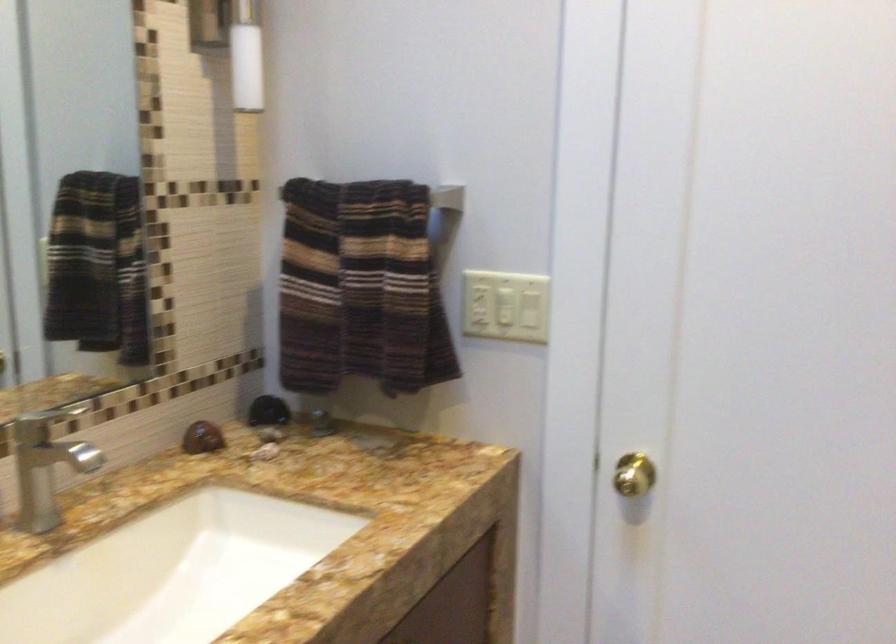
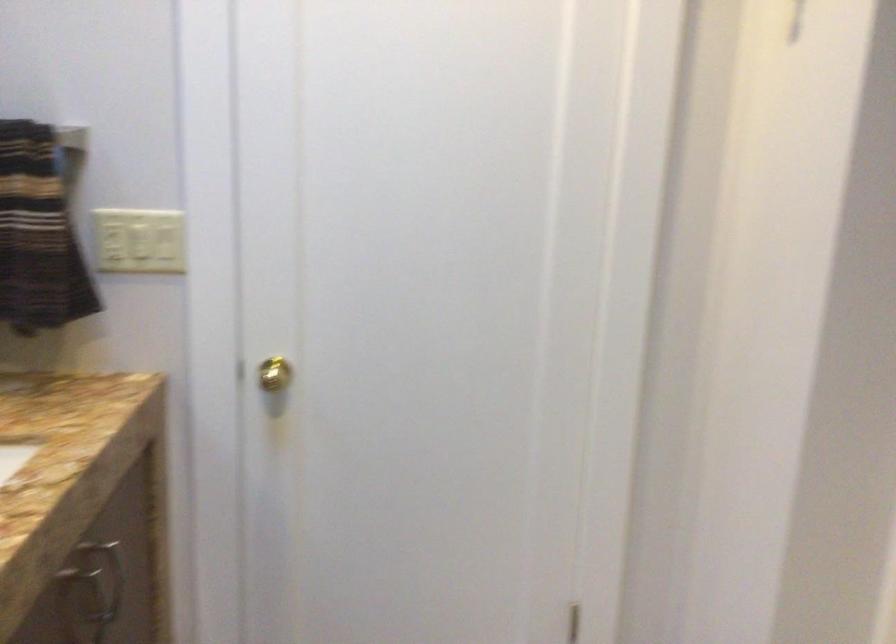
Question: The first image is from the beginning of the video and the second image is from the end. How did the camera likely rotate when shooting the video?

Choices:
 (A) Left
 (B) Right
 (C) Up
 (D) Down

Answer: (B)